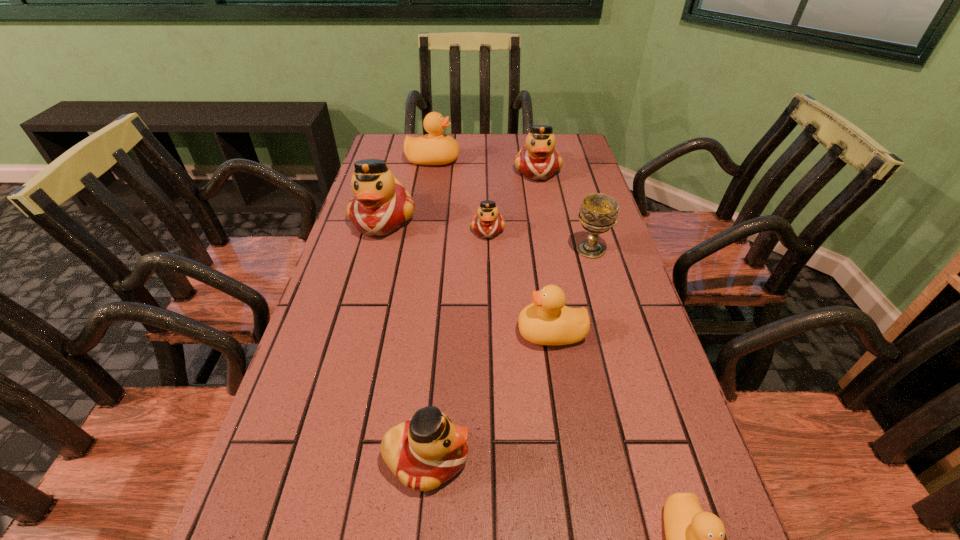
Locate an element on the screen. This screenshot has width=960, height=540. yellow duck that is the nearest to the farthest red duck is located at coordinates (435, 148).

Where is `yellow duck identified as the second closest to the white chalice`? This screenshot has height=540, width=960. yellow duck identified as the second closest to the white chalice is located at coordinates (435, 148).

Image resolution: width=960 pixels, height=540 pixels. I want to click on free location that satisfies the following two spatial constraints: 1. on the face of the rightmost red duck; 2. on the right side of the chalice, so click(553, 249).

At what (x,y) coordinates should I click in order to perform the action: click on free spot that satisfies the following two spatial constraints: 1. on the face of the rightmost red duck; 2. on the face of the second farthest yellow duck. Please return your answer as a coordinate pair (x, y). This screenshot has height=540, width=960. Looking at the image, I should click on coord(568,333).